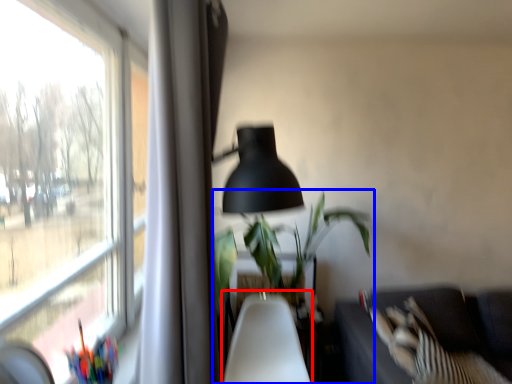
Question: Which point is further to the camera, swivel chair (highlighted by a red box) or houseplant (highlighted by a blue box)?

Choices:
 (A) swivel chair
 (B) houseplant

Answer: (B)